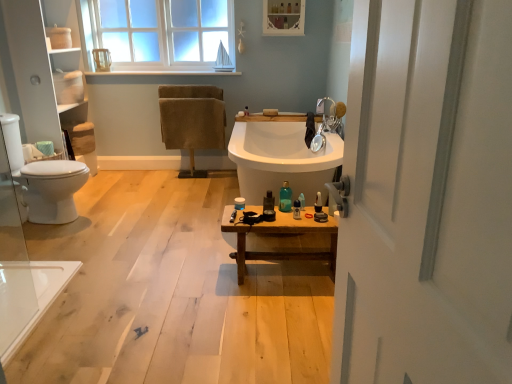
Question: Is the depth of matte white medicine cabinet at upper center less than that of matte black razor at center, marked as the sixth toiletry in a left-to-right arrangement?

Choices:
 (A) no
 (B) yes

Answer: (A)

Question: Is matte white medicine cabinet at upper center oriented away from matte black razor at center, marked as the sixth toiletry in a left-to-right arrangement?

Choices:
 (A) no
 (B) yes

Answer: (A)

Question: Can you confirm if matte white medicine cabinet at upper center is shorter than matte black razor at center, placed as the 1th toiletry when sorted from right to left?

Choices:
 (A) no
 (B) yes

Answer: (A)

Question: Considering the relative positions of matte white medicine cabinet at upper center and matte black razor at center, placed as the 1th toiletry when sorted from right to left, in the image provided, is matte white medicine cabinet at upper center to the left of matte black razor at center, placed as the 1th toiletry when sorted from right to left, from the viewer's perspective?

Choices:
 (A) no
 (B) yes

Answer: (B)

Question: Considering the relative positions of matte white medicine cabinet at upper center and matte black razor at center, marked as the sixth toiletry in a left-to-right arrangement, in the image provided, is matte white medicine cabinet at upper center behind matte black razor at center, marked as the sixth toiletry in a left-to-right arrangement,?

Choices:
 (A) yes
 (B) no

Answer: (A)

Question: Considering the positions of translucent plastic bottle at center, marked as the 4th toiletry in a left-to-right arrangement, and matte white container at center, which is the sixth toiletry in right-to-left order, in the image, is translucent plastic bottle at center, marked as the 4th toiletry in a left-to-right arrangement, wider or thinner than matte white container at center, which is the sixth toiletry in right-to-left order,?

Choices:
 (A) thin
 (B) wide

Answer: (A)

Question: Considering the relative positions of translucent plastic bottle at center, which appears as the third toiletry when viewed from the right, and matte white container at center, which appears as the first toiletry when viewed from the left, in the image provided, is translucent plastic bottle at center, which appears as the third toiletry when viewed from the right, to the left or to the right of matte white container at center, which appears as the first toiletry when viewed from the left,?

Choices:
 (A) right
 (B) left

Answer: (A)

Question: From a real-world perspective, relative to matte white container at center, which is the sixth toiletry in right-to-left order, is translucent plastic bottle at center, which appears as the third toiletry when viewed from the right, vertically above or below?

Choices:
 (A) below
 (B) above

Answer: (B)

Question: Which is correct: translucent plastic bottle at center, marked as the 4th toiletry in a left-to-right arrangement, is inside matte white container at center, which is the sixth toiletry in right-to-left order, or outside of it?

Choices:
 (A) outside
 (B) inside

Answer: (A)

Question: Considering the positions of translucent plastic bottle at center, marked as the 4th toiletry in a left-to-right arrangement, and wooden bench at center in the image, is translucent plastic bottle at center, marked as the 4th toiletry in a left-to-right arrangement, wider or thinner than wooden bench at center?

Choices:
 (A) thin
 (B) wide

Answer: (A)

Question: Based on their positions, is translucent plastic bottle at center, which appears as the third toiletry when viewed from the right, located to the left or right of wooden bench at center?

Choices:
 (A) left
 (B) right

Answer: (B)

Question: In the image, is translucent plastic bottle at center, which appears as the third toiletry when viewed from the right, positioned in front of or behind wooden bench at center?

Choices:
 (A) front
 (B) behind

Answer: (B)

Question: From a real-world perspective, relative to wooden bench at center, is translucent plastic bottle at center, marked as the 4th toiletry in a left-to-right arrangement, vertically above or below?

Choices:
 (A) below
 (B) above

Answer: (B)

Question: Looking at the image, does translucent plastic tube at center, acting as the 2th toiletry starting from the right, seem bigger or smaller compared to translucent plastic bottle at center, which is the second toiletry from left to right?

Choices:
 (A) big
 (B) small

Answer: (B)

Question: Is translucent plastic tube at center, acting as the 2th toiletry starting from the right, in front of or behind translucent plastic bottle at center, which appears as the fifth toiletry when viewed from the right, in the image?

Choices:
 (A) front
 (B) behind

Answer: (B)